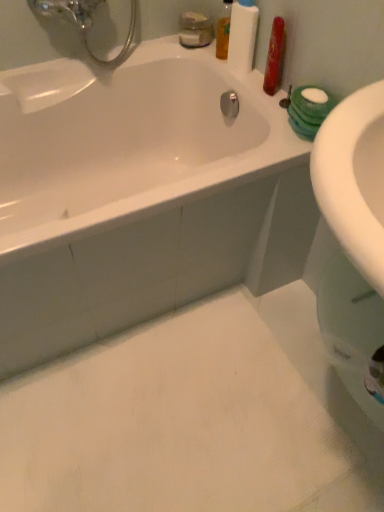
Question: Is white matte bottle at upper right completely or partially inside translucent orange liquid at upper right, the first mouthwash viewed from the right?

Choices:
 (A) no
 (B) yes

Answer: (A)

Question: Is translucent orange liquid at upper right, the first mouthwash viewed from the right, thinner than white matte bottle at upper right?

Choices:
 (A) no
 (B) yes

Answer: (B)

Question: Considering the relative sizes of translucent orange liquid at upper right, the 2th mouthwash from the left, and white matte bottle at upper right in the image provided, is translucent orange liquid at upper right, the 2th mouthwash from the left, smaller than white matte bottle at upper right?

Choices:
 (A) yes
 (B) no

Answer: (A)

Question: From the image's perspective, is translucent orange liquid at upper right, the first mouthwash viewed from the right, on top of white matte bottle at upper right?

Choices:
 (A) no
 (B) yes

Answer: (B)

Question: Would you say translucent orange liquid at upper right, the 2th mouthwash from the left, is outside white matte bottle at upper right?

Choices:
 (A) no
 (B) yes

Answer: (B)

Question: Are translucent orange liquid at upper right, the 2th mouthwash from the left, and white matte bottle at upper right located far from each other?

Choices:
 (A) yes
 (B) no

Answer: (B)

Question: Is translucent plastic mouthwash at upper center, acting as the 1th mouthwash starting from the left, directly adjacent to translucent orange liquid at upper right, the first mouthwash viewed from the right?

Choices:
 (A) no
 (B) yes

Answer: (B)

Question: Is translucent plastic mouthwash at upper center, placed as the second mouthwash when sorted from right to left, not within translucent orange liquid at upper right, the 2th mouthwash from the left?

Choices:
 (A) yes
 (B) no

Answer: (A)

Question: Would you say translucent orange liquid at upper right, the first mouthwash viewed from the right, is part of translucent plastic mouthwash at upper center, placed as the second mouthwash when sorted from right to left,'s contents?

Choices:
 (A) yes
 (B) no

Answer: (B)

Question: Can you confirm if translucent plastic mouthwash at upper center, placed as the second mouthwash when sorted from right to left, is shorter than translucent orange liquid at upper right, the first mouthwash viewed from the right?

Choices:
 (A) no
 (B) yes

Answer: (B)

Question: Is translucent plastic mouthwash at upper center, acting as the 1th mouthwash starting from the left, aimed at translucent orange liquid at upper right, the first mouthwash viewed from the right?

Choices:
 (A) no
 (B) yes

Answer: (A)

Question: Does translucent plastic mouthwash at upper center, placed as the second mouthwash when sorted from right to left, have a smaller size compared to translucent orange liquid at upper right, the first mouthwash viewed from the right?

Choices:
 (A) no
 (B) yes

Answer: (A)

Question: Is translucent orange liquid at upper right, the 2th mouthwash from the left, completely or partially outside of translucent plastic mouthwash at upper center, acting as the 1th mouthwash starting from the left?

Choices:
 (A) no
 (B) yes

Answer: (B)